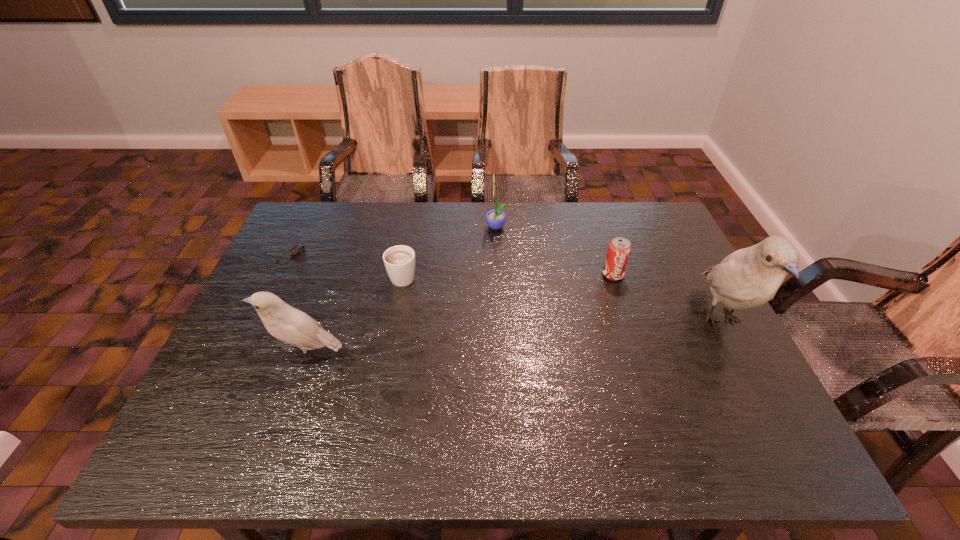
I want to click on the left bird, so click(x=284, y=322).

You are a GUI agent. You are given a task and a screenshot of the screen. Output one action in this format:
    pyautogui.click(x=<x>, y=<y>)
    Task: Click on the fifth object from right to left
    The height and width of the screenshot is (540, 960).
    Given the screenshot: What is the action you would take?
    click(284, 322)

Identify the location of the taller bird. (750, 277).

Where is `the right bird`? The image size is (960, 540). the right bird is located at coordinates (750, 277).

I want to click on the shortest object, so [298, 248].

You are a GUI agent. You are given a task and a screenshot of the screen. Output one action in this format:
    pyautogui.click(x=<x>, y=<y>)
    Task: Click on the leftmost object
    
    Given the screenshot: What is the action you would take?
    pyautogui.click(x=298, y=248)

The height and width of the screenshot is (540, 960). I want to click on soda can, so click(x=619, y=249).

Find the location of a particular element. This screenshot has height=540, width=960. the fourth tallest object is located at coordinates (619, 249).

Find the location of a particular element. The width and height of the screenshot is (960, 540). the fourth object from left to right is located at coordinates (495, 219).

Find the location of a particular element. the farthest object is located at coordinates (495, 219).